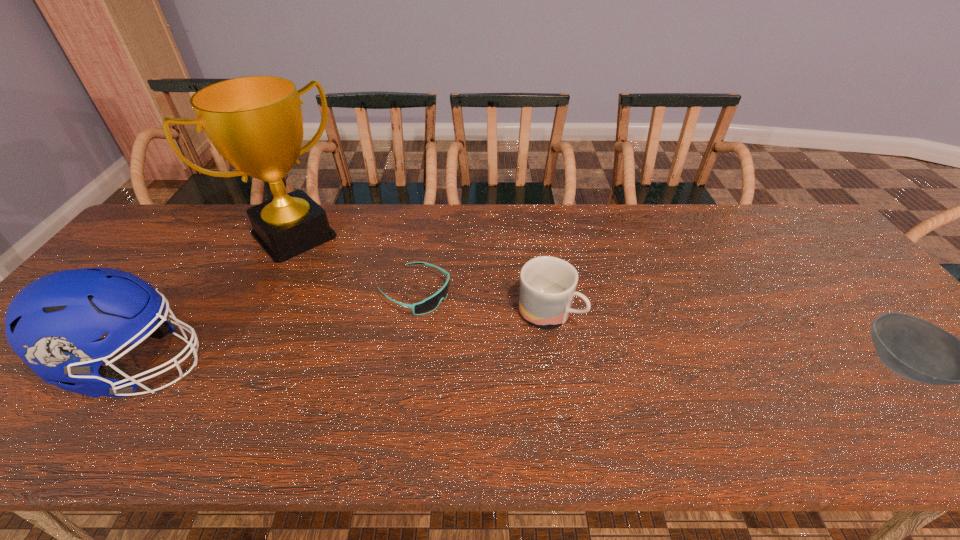
The width and height of the screenshot is (960, 540). I want to click on football helmet, so click(x=54, y=324).

At what (x,y) coordinates should I click in order to perform the action: click on sunglasses. Please return your answer as a coordinate pair (x, y). The image size is (960, 540). Looking at the image, I should click on (429, 304).

This screenshot has height=540, width=960. I want to click on the shortest object, so click(x=429, y=304).

Identify the location of the tallest object. This screenshot has width=960, height=540. (255, 122).

The width and height of the screenshot is (960, 540). Identify the location of award. (255, 122).

Locate an element on the screen. The width and height of the screenshot is (960, 540). the second object from right to left is located at coordinates point(548,284).

The height and width of the screenshot is (540, 960). I want to click on the third tallest object, so click(x=548, y=284).

I want to click on vacant space situated 0.160m on the front-facing side of the football helmet, so click(x=276, y=366).

Find the location of a particular element. Image resolution: width=960 pixels, height=540 pixels. vacant space located on the front-facing side of the third object from left to right is located at coordinates (480, 327).

You are a GUI agent. You are given a task and a screenshot of the screen. Output one action in this format:
    pyautogui.click(x=<x>, y=<y>)
    Task: Click on the vacant area situated 0.190m on the front-facing side of the third object from left to right
    The image size is (960, 540).
    Given the screenshot: What is the action you would take?
    pyautogui.click(x=504, y=340)